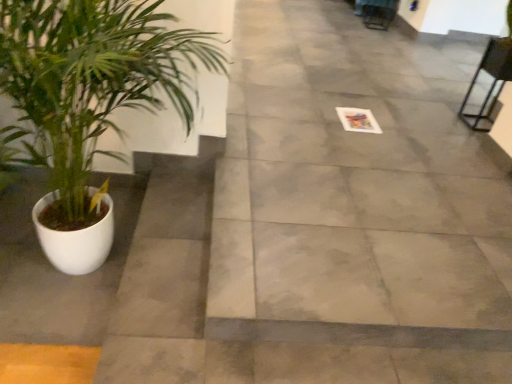
In order to click on green leafy plant at left in this screenshot , I will do `click(92, 101)`.

Locate an element on the screen. The height and width of the screenshot is (384, 512). green leafy plant at left is located at coordinates (92, 101).

Between gray concrete pavement at center and metallic black chair at upper right, which one appears on the right side from the viewer's perspective?

Positioned to the right is metallic black chair at upper right.

Measure the distance between gray concrete pavement at center and metallic black chair at upper right.

gray concrete pavement at center is 34.87 inches away from metallic black chair at upper right.

Can you tell me how much gray concrete pavement at center and metallic black chair at upper right differ in facing direction?

They differ by 88.6 degrees in their facing directions.

Considering the relative sizes of gray concrete pavement at center and metallic black chair at upper right in the image provided, is gray concrete pavement at center thinner than metallic black chair at upper right?

No, gray concrete pavement at center is not thinner than metallic black chair at upper right.

Choose the correct answer: Is metallic black chair at upper right inside gray concrete pavement at center or outside it?

metallic black chair at upper right is spatially situated outside gray concrete pavement at center.

Is metallic black chair at upper right closer to the viewer compared to gray concrete pavement at center?

No.

Considering the points (474, 77) and (306, 324), which point is behind, point (474, 77) or point (306, 324)?

The point (474, 77) is behind.

From a real-world perspective, is green leafy plant at left located beneath gray concrete pavement at center?

No, from a real-world perspective, green leafy plant at left is not under gray concrete pavement at center.

Which is more to the left, green leafy plant at left or gray concrete pavement at center?

green leafy plant at left.

Does green leafy plant at left contain gray concrete pavement at center?

That's incorrect, gray concrete pavement at center is not inside green leafy plant at left.

Is point (53, 22) less distant than point (458, 72)?

Yes, point (53, 22) is closer to viewer.

Based on their positions, is gray concrete pavement at center located to the left or right of green leafy plant at left?

Clearly, gray concrete pavement at center is on the right of green leafy plant at left in the image.

In terms of size, does gray concrete pavement at center appear bigger or smaller than green leafy plant at left?

Clearly, gray concrete pavement at center is smaller in size than green leafy plant at left.

Where is `houseplant that is above the gray concrete pavement at center (from a real-world perspective)`? This screenshot has width=512, height=384. houseplant that is above the gray concrete pavement at center (from a real-world perspective) is located at coordinates (92, 101).

At what (x,y) coordinates should I click in order to perform the action: click on houseplant located in front of the metallic black chair at upper right. Please return your answer as a coordinate pair (x, y). Looking at the image, I should click on (92, 101).

From the image's perspective, who appears lower, metallic black chair at upper right or green leafy plant at left?

green leafy plant at left.

Is metallic black chair at upper right outside of green leafy plant at left?

metallic black chair at upper right lies outside green leafy plant at left's area.

Which point is more distant from viewer, (486, 98) or (172, 81)?

The point (486, 98) is behind.

Is green leafy plant at left inside the boundaries of metallic black chair at upper right, or outside?

green leafy plant at left exists outside the volume of metallic black chair at upper right.

Is green leafy plant at left turned away from metallic black chair at upper right?

No, metallic black chair at upper right is not at the back of green leafy plant at left.

Looking at this image, is green leafy plant at left far from metallic black chair at upper right?

Yes, green leafy plant at left and metallic black chair at upper right are quite far apart.

From a real-world perspective, is green leafy plant at left physically located above or below metallic black chair at upper right?

green leafy plant at left is situated higher than metallic black chair at upper right in the real world.

This screenshot has height=384, width=512. Find the location of `pavement below the metallic black chair at upper right (from a real-world perspective)`. pavement below the metallic black chair at upper right (from a real-world perspective) is located at coordinates (352, 215).

Find the location of a particular element. This screenshot has width=512, height=384. pavement that appears above the metallic black chair at upper right (from the image's perspective) is located at coordinates (352, 215).

When comparing their distances from green leafy plant at left, does gray concrete pavement at center or metallic black chair at upper right seem closer?

gray concrete pavement at center is positioned closer to the anchor green leafy plant at left.

When comparing their distances from gray concrete pavement at center, does metallic black chair at upper right or green leafy plant at left seem further?

metallic black chair at upper right is further to gray concrete pavement at center.

Based on the photo, when comparing their distances from gray concrete pavement at center, does green leafy plant at left or metallic black chair at upper right seem further?

metallic black chair at upper right is positioned further to the anchor gray concrete pavement at center.

Considering their positions, is gray concrete pavement at center positioned further to metallic black chair at upper right than green leafy plant at left?

Among the two, green leafy plant at left is located further to metallic black chair at upper right.

Which object lies nearer to the anchor point metallic black chair at upper right, green leafy plant at left or gray concrete pavement at center?

gray concrete pavement at center is positioned closer to the anchor metallic black chair at upper right.

From the image, which object appears to be farther from green leafy plant at left, metallic black chair at upper right or gray concrete pavement at center?

metallic black chair at upper right is further to green leafy plant at left.

The width and height of the screenshot is (512, 384). Find the location of `pavement located between green leafy plant at left and metallic black chair at upper right in the left-right direction`. pavement located between green leafy plant at left and metallic black chair at upper right in the left-right direction is located at coordinates (352, 215).